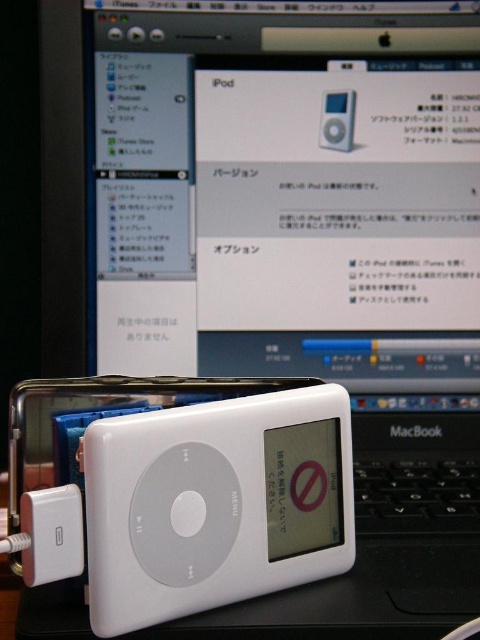
Question: Is white glossy ipod at center below white plastic ipod at center?

Choices:
 (A) no
 (B) yes

Answer: (B)

Question: Does white plastic ipod at lower left appear over white plastic ipod at center?

Choices:
 (A) no
 (B) yes

Answer: (A)

Question: Which point is closer to the camera?

Choices:
 (A) (335, 132)
 (B) (72, 563)

Answer: (B)

Question: Which object is closer to the camera taking this photo?

Choices:
 (A) white plastic ipod at center
 (B) white plastic ipod at lower left
 (C) white glossy ipod at center

Answer: (B)

Question: In this image, where is white glossy ipod at center located relative to white plastic ipod at lower left?

Choices:
 (A) above
 (B) below

Answer: (A)

Question: Which point appears closest to the camera in this image?

Choices:
 (A) (34, 561)
 (B) (339, 124)
 (C) (203, 554)

Answer: (A)